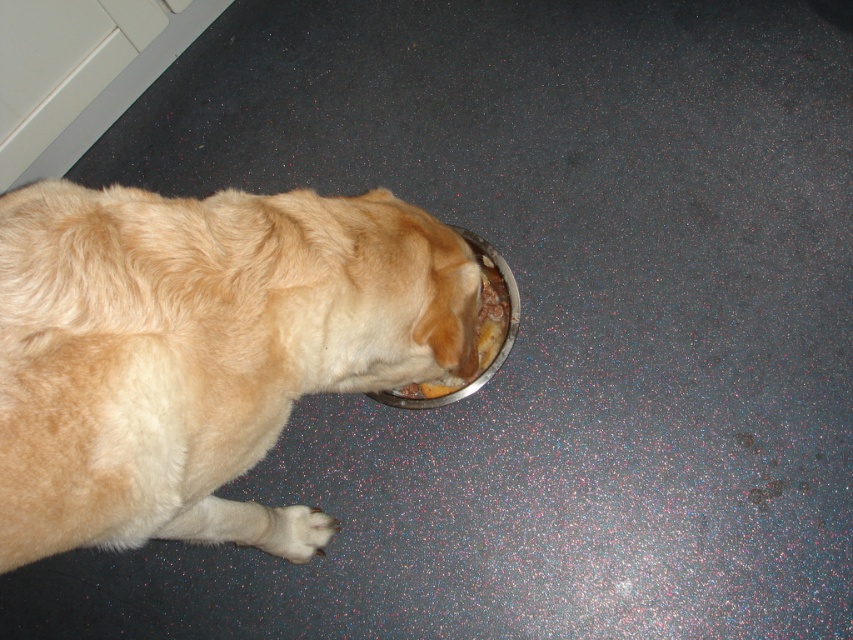
Does white fur paw at lower left have a greater height compared to metallic silver bowl at lower center?

In fact, white fur paw at lower left may be shorter than metallic silver bowl at lower center.

Is white fur paw at lower left thinner than metallic silver bowl at lower center?

Indeed, white fur paw at lower left has a lesser width compared to metallic silver bowl at lower center.

At what (x,y) coordinates should I click in order to perform the action: click on white fur paw at lower left. Please return your answer as a coordinate pair (x, y). Looking at the image, I should click on (294, 531).

In order to click on white fur paw at lower left in this screenshot , I will do `click(294, 531)`.

Who is positioned more to the right, golden fur dog at lower left or metallic silver bowl at lower center?

Positioned to the right is metallic silver bowl at lower center.

Measure the distance between golden fur dog at lower left and camera.

They are 26.64 inches apart.

At what (x,y) coordinates should I click in order to perform the action: click on golden fur dog at lower left. Please return your answer as a coordinate pair (x, y). Image resolution: width=853 pixels, height=640 pixels. Looking at the image, I should click on (196, 346).

Between golden fur dog at lower left and white fur paw at lower left, which one appears on the left side from the viewer's perspective?

Positioned to the left is white fur paw at lower left.

Is point (256, 337) farther from viewer compared to point (296, 524)?

No, it is not.

Locate an element on the screen. This screenshot has width=853, height=640. golden fur dog at lower left is located at coordinates (196, 346).